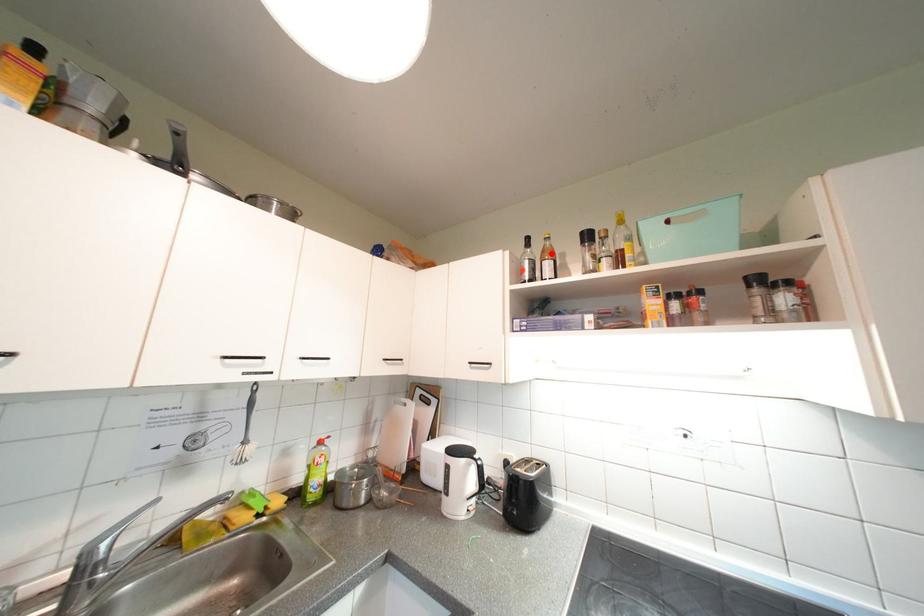
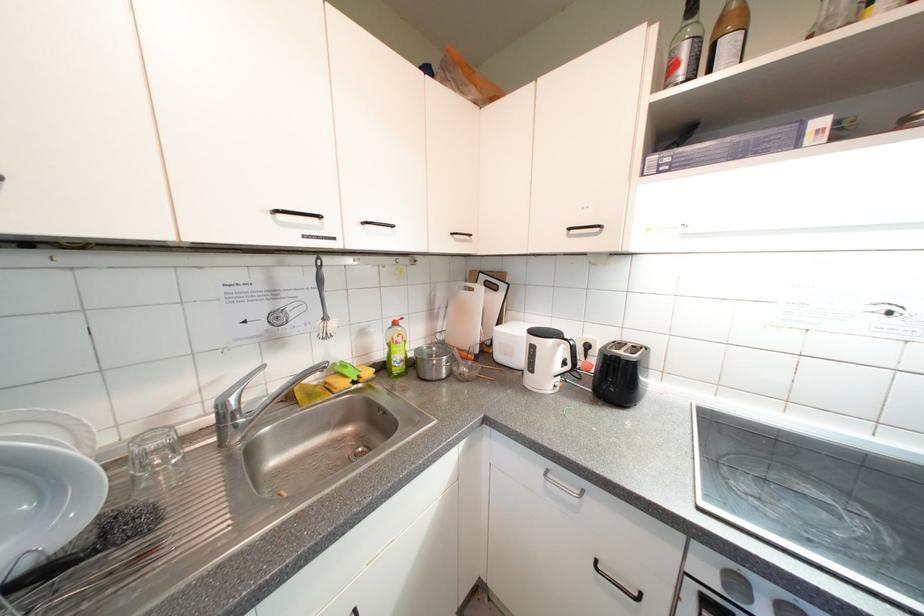
Find the pixel in the second image that matches the highlighted location in the first image.

(728, 23)